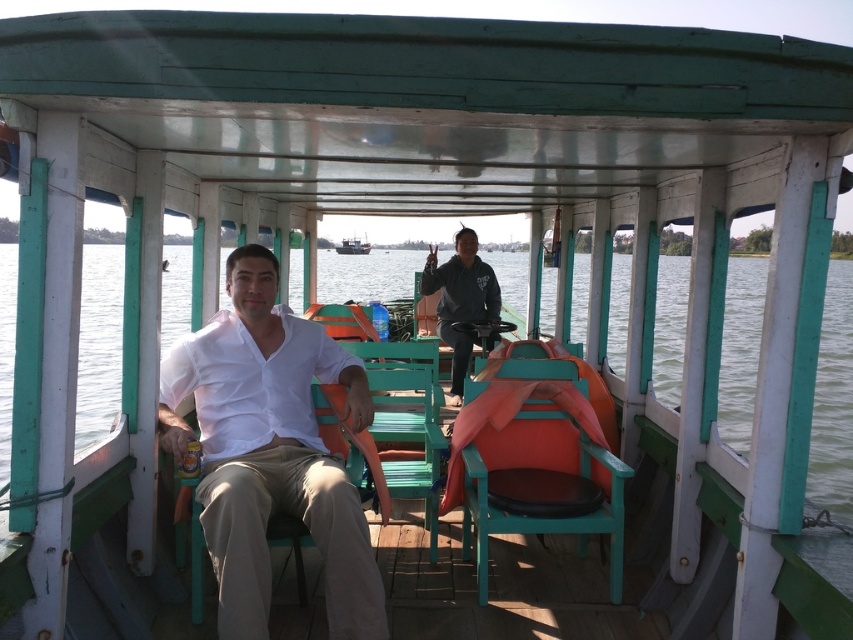
Is teal wood chair at center behind wooden boat at center?

No, teal wood chair at center is closer to the viewer.

From the picture: Which is below, teal wood chair at center or wooden boat at center?

teal wood chair at center is lower down.

Between point (469, 412) and point (354, 237), which one is positioned behind?

The point (354, 237) is behind.

The height and width of the screenshot is (640, 853). Find the location of `teal wood chair at center`. teal wood chair at center is located at coordinates (535, 464).

Can you confirm if teal wood chair at center is thinner than dark gray hoodie at center?

No, teal wood chair at center is not thinner than dark gray hoodie at center.

Is teal wood chair at center below dark gray hoodie at center?

Indeed, teal wood chair at center is positioned under dark gray hoodie at center.

Measure the distance between teal wood chair at center and camera.

The distance of teal wood chair at center from camera is 3.35 meters.

You are a GUI agent. You are given a task and a screenshot of the screen. Output one action in this format:
    pyautogui.click(x=<x>, y=<y>)
    Task: Click on the teal wood chair at center
    The height and width of the screenshot is (640, 853).
    Given the screenshot: What is the action you would take?
    pyautogui.click(x=535, y=464)

Can you confirm if green wood chair at center is positioned above wooden boat at center?

Actually, green wood chair at center is below wooden boat at center.

Between point (428, 492) and point (335, 250), which one is positioned in front?

Point (428, 492) is in front.

Identify the location of green wood chair at center. (393, 413).